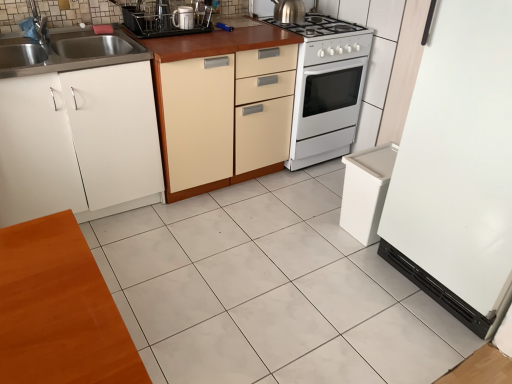
Locate an element on the screen. free spot to the left of white glossy refrigerator at right, marked as the 2th appliance in a top-to-bottom arrangement is located at coordinates (334, 282).